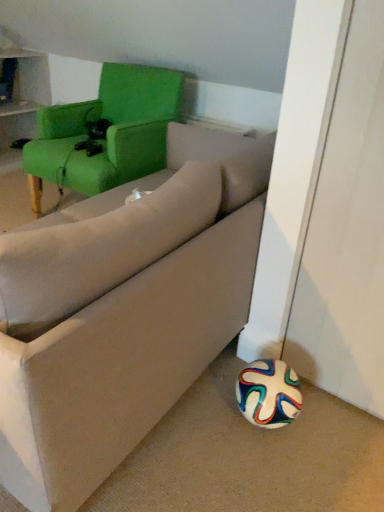
The image size is (384, 512). Describe the element at coordinates (123, 311) in the screenshot. I see `beige fabric couch at lower right` at that location.

Identify the location of beige fabric pillow at center. The height and width of the screenshot is (512, 384). (101, 248).

Can you confirm if green fabric chair at upper left is thinner than beige fabric couch at lower right?

Indeed, green fabric chair at upper left has a lesser width compared to beige fabric couch at lower right.

Is green fabric chair at upper left closer to the viewer compared to beige fabric couch at lower right?

No, the depth of green fabric chair at upper left is greater than that of beige fabric couch at lower right.

Who is smaller, green fabric chair at upper left or beige fabric couch at lower right?

Smaller between the two is beige fabric couch at lower right.

Is beige fabric pillow at center located outside beige fabric couch at lower right?

beige fabric pillow at center lies outside beige fabric couch at lower right's area.

Which of these two, beige fabric pillow at center or beige fabric couch at lower right, is wider?

beige fabric couch at lower right is wider.

Is beige fabric pillow at center with beige fabric couch at lower right?

No.

Is beige fabric pillow at center further to camera compared to beige fabric couch at lower right?

Yes, it is.

Between beige fabric pillow at center and green fabric chair at upper left, which one has larger width?

green fabric chair at upper left is wider.

From their relative heights in the image, would you say beige fabric pillow at center is taller or shorter than green fabric chair at upper left?

In the image, beige fabric pillow at center appears to be shorter than green fabric chair at upper left.

From the picture: Would you say beige fabric pillow at center contains green fabric chair at upper left?

No, green fabric chair at upper left is not surrounded by beige fabric pillow at center.

How different are the orientations of beige fabric pillow at center and green fabric chair at upper left in degrees?

The angle between the facing direction of beige fabric pillow at center and the facing direction of green fabric chair at upper left is 105 degrees.

From a real-world perspective, who is located lower, green fabric chair at upper left or beige fabric pillow at center?

green fabric chair at upper left, from a real-world perspective.

Is the position of green fabric chair at upper left less distant than that of beige fabric pillow at center?

No.

Would you say beige fabric pillow at center is part of green fabric chair at upper left's contents?

Actually, beige fabric pillow at center is outside green fabric chair at upper left.

Is beige fabric couch at lower right not near green fabric chair at upper left?

Absolutely, beige fabric couch at lower right is distant from green fabric chair at upper left.

Which object is positioned more to the right, beige fabric couch at lower right or green fabric chair at upper left?

green fabric chair at upper left is more to the right.

How many degrees apart are the facing directions of beige fabric couch at lower right and green fabric chair at upper left?

89.4 degrees separate the facing orientations of beige fabric couch at lower right and green fabric chair at upper left.

From the image's perspective, which one is positioned higher, beige fabric couch at lower right or beige fabric pillow at center?

beige fabric couch at lower right, from the image's perspective.

Where is `pillow that is behind the beige fabric couch at lower right`? pillow that is behind the beige fabric couch at lower right is located at coordinates (101, 248).

From a real-world perspective, is beige fabric couch at lower right positioned over beige fabric pillow at center based on gravity?

No, from a real-world perspective, beige fabric couch at lower right is not on top of beige fabric pillow at center.

Considering the sizes of objects beige fabric couch at lower right and beige fabric pillow at center in the image provided, who is bigger, beige fabric couch at lower right or beige fabric pillow at center?

beige fabric couch at lower right.

The width and height of the screenshot is (384, 512). I want to click on studio couch on the left of the green fabric chair at upper left, so click(x=123, y=311).

Where is `pillow that is below the beige fabric couch at lower right (from the image's perspective)`? This screenshot has height=512, width=384. pillow that is below the beige fabric couch at lower right (from the image's perspective) is located at coordinates (101, 248).

Looking at the image, which one is located further to green fabric chair at upper left, beige fabric pillow at center or beige fabric couch at lower right?

beige fabric pillow at center is further to green fabric chair at upper left.

When comparing their distances from beige fabric pillow at center, does beige fabric couch at lower right or green fabric chair at upper left seem further?

green fabric chair at upper left is further to beige fabric pillow at center.

From the image, which object appears to be farther from beige fabric pillow at center, green fabric chair at upper left or beige fabric couch at lower right?

green fabric chair at upper left.

Considering their positions, is beige fabric pillow at center positioned further to beige fabric couch at lower right than green fabric chair at upper left?

The object further to beige fabric couch at lower right is green fabric chair at upper left.

Based on their spatial positions, is green fabric chair at upper left or beige fabric pillow at center closer to beige fabric couch at lower right?

Based on the image, beige fabric pillow at center appears to be nearer to beige fabric couch at lower right.

When comparing their distances from green fabric chair at upper left, does beige fabric couch at lower right or beige fabric pillow at center seem further?

beige fabric pillow at center is further to green fabric chair at upper left.

The image size is (384, 512). What are the coordinates of `pillow between beige fabric couch at lower right and green fabric chair at upper left from front to back` in the screenshot? It's located at (101, 248).